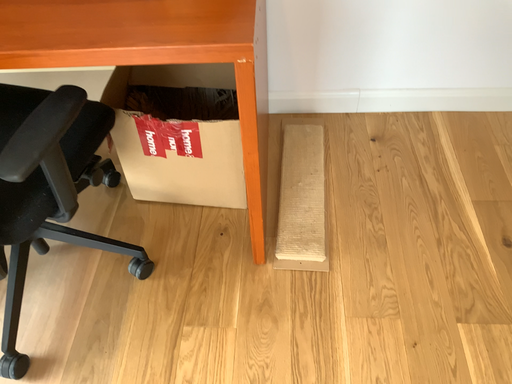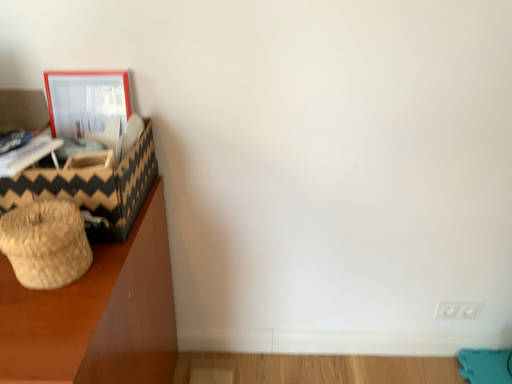
Question: How did the camera likely rotate when shooting the video?

Choices:
 (A) rotated upward
 (B) rotated downward

Answer: (A)